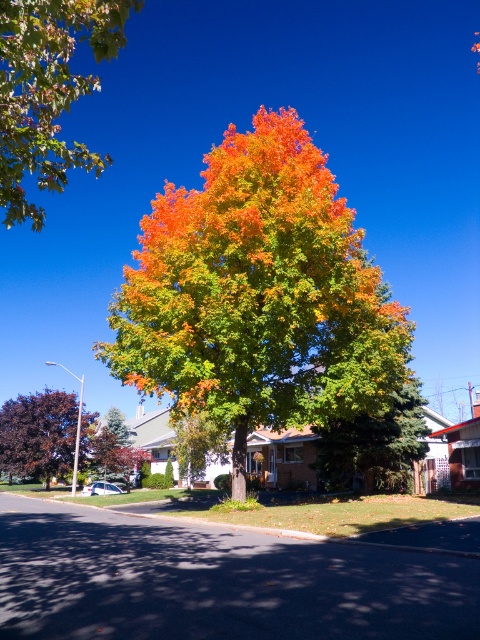
You are standing at a point 6.60 meters away from the point marked at coordinates point (51, 179). If you want to walk directly towards that point, how far will you have to walk?

You will have to walk 6.60 meters to reach the point marked at coordinates point (51, 179) because you are currently 6.60 meters away from it.

You are a gardener planning to plant a new tree between the green matte tree at center and the purple glossy tree at left. Based on their current positions, where should you place the new tree so it aligns with the existing arrangement?

The green matte tree at center is to the right of the purple glossy tree at left, so the new tree should be placed between them, maintaining the left to right order of purple glossy tree at left and green matte tree at center.

You are a gardener planning to plant a new tree in this suburban area. You need to know the relative positions of the green matte tree at center and the purple glossy tree at left to ensure proper spacing. Which tree is located above the other?

The green matte tree at center is positioned over the purple glossy tree at left, meaning it is situated above it in the scene.